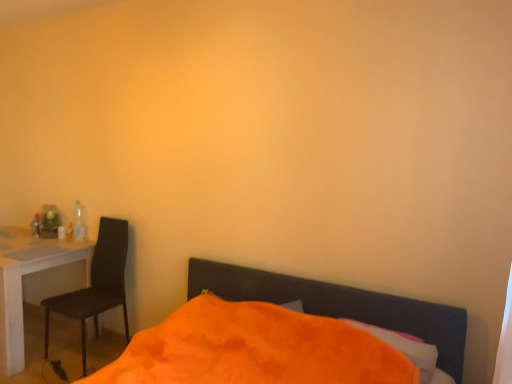
Question: Is orange soft pillow at lower center surrounded by black matte chair at left?

Choices:
 (A) no
 (B) yes

Answer: (A)

Question: From the image's perspective, is black matte chair at left located beneath orange soft pillow at lower center?

Choices:
 (A) no
 (B) yes

Answer: (A)

Question: Considering the relative sizes of black matte chair at left and orange soft pillow at lower center in the image provided, is black matte chair at left thinner than orange soft pillow at lower center?

Choices:
 (A) no
 (B) yes

Answer: (A)

Question: From a real-world perspective, is black matte chair at left beneath orange soft pillow at lower center?

Choices:
 (A) no
 (B) yes

Answer: (B)

Question: From a real-world perspective, does black matte chair at left stand above orange soft pillow at lower center?

Choices:
 (A) no
 (B) yes

Answer: (A)

Question: From the image's perspective, relative to white glossy desk at left, is translucent plastic bottle at left above or below?

Choices:
 (A) above
 (B) below

Answer: (A)

Question: Considering the positions of point (74, 228) and point (16, 288), is point (74, 228) closer or farther from the camera than point (16, 288)?

Choices:
 (A) farther
 (B) closer

Answer: (A)

Question: Is translucent plastic bottle at left inside or outside of white glossy desk at left?

Choices:
 (A) outside
 (B) inside

Answer: (A)

Question: Looking at the image, does translucent plastic bottle at left seem bigger or smaller compared to white glossy desk at left?

Choices:
 (A) small
 (B) big

Answer: (A)

Question: In terms of size, does white glossy desk at left appear bigger or smaller than orange soft pillow at lower center?

Choices:
 (A) small
 (B) big

Answer: (B)

Question: From a real-world perspective, is white glossy desk at left physically located above or below orange soft pillow at lower center?

Choices:
 (A) above
 (B) below

Answer: (B)

Question: Considering the positions of white glossy desk at left and orange soft pillow at lower center in the image, is white glossy desk at left taller or shorter than orange soft pillow at lower center?

Choices:
 (A) tall
 (B) short

Answer: (A)

Question: Is point (18, 299) positioned closer to the camera than point (376, 329)?

Choices:
 (A) farther
 (B) closer

Answer: (A)

Question: From the image's perspective, is orange soft pillow at lower center positioned above or below white glossy desk at left?

Choices:
 (A) above
 (B) below

Answer: (A)

Question: Is orange soft pillow at lower center inside or outside of white glossy desk at left?

Choices:
 (A) inside
 (B) outside

Answer: (B)